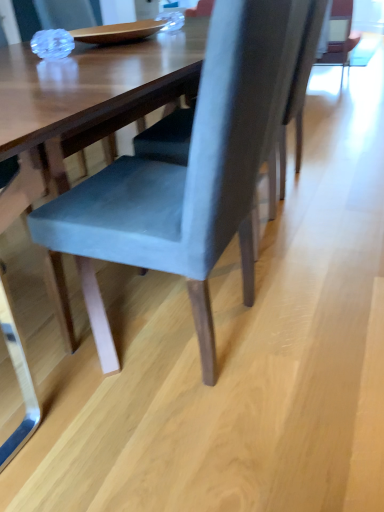
Question: Which direction should I rotate to look at velvet blue chair at center, the 2th chair from the back?

Choices:
 (A) left
 (B) right

Answer: (A)

Question: In which direction should I rotate to look at suede-like gray chair at center, the 2th chair viewed from the front?

Choices:
 (A) right
 (B) left

Answer: (A)

Question: From a real-world perspective, is velvet blue chair at center, placed as the 1th chair when sorted from front to back, located beneath suede-like gray chair at center, the 2th chair viewed from the front?

Choices:
 (A) no
 (B) yes

Answer: (A)

Question: Considering the relative sizes of velvet blue chair at center, the 2th chair from the back, and suede-like gray chair at center, the 2th chair viewed from the front, in the image provided, is velvet blue chair at center, the 2th chair from the back, thinner than suede-like gray chair at center, the 2th chair viewed from the front,?

Choices:
 (A) yes
 (B) no

Answer: (A)

Question: Does velvet blue chair at center, placed as the 1th chair when sorted from front to back, have a smaller size compared to suede-like gray chair at center, marked as the first chair in a back-to-front arrangement?

Choices:
 (A) no
 (B) yes

Answer: (A)

Question: Could you tell me if velvet blue chair at center, the 2th chair from the back, is facing suede-like gray chair at center, marked as the first chair in a back-to-front arrangement?

Choices:
 (A) no
 (B) yes

Answer: (A)

Question: Can you confirm if velvet blue chair at center, placed as the 1th chair when sorted from front to back, is bigger than suede-like gray chair at center, marked as the first chair in a back-to-front arrangement?

Choices:
 (A) yes
 (B) no

Answer: (A)

Question: Can you confirm if velvet blue chair at center, the 2th chair from the back, is wider than suede-like gray chair at center, marked as the first chair in a back-to-front arrangement?

Choices:
 (A) no
 (B) yes

Answer: (A)

Question: Considering the relative sizes of suede-like gray chair at center, the 2th chair viewed from the front, and velvet blue chair at center, the 2th chair from the back, in the image provided, is suede-like gray chair at center, the 2th chair viewed from the front, thinner than velvet blue chair at center, the 2th chair from the back,?

Choices:
 (A) yes
 (B) no

Answer: (B)

Question: From the image's perspective, is suede-like gray chair at center, marked as the first chair in a back-to-front arrangement, below velvet blue chair at center, the 2th chair from the back?

Choices:
 (A) yes
 (B) no

Answer: (B)

Question: Is suede-like gray chair at center, the 2th chair viewed from the front, with velvet blue chair at center, the 2th chair from the back?

Choices:
 (A) no
 (B) yes

Answer: (A)

Question: Does suede-like gray chair at center, the 2th chair viewed from the front, come behind velvet blue chair at center, placed as the 1th chair when sorted from front to back?

Choices:
 (A) no
 (B) yes

Answer: (B)

Question: Is suede-like gray chair at center, the 2th chair viewed from the front, smaller than velvet blue chair at center, the 2th chair from the back?

Choices:
 (A) yes
 (B) no

Answer: (A)

Question: Is suede-like gray chair at center, marked as the first chair in a back-to-front arrangement, positioned beyond the bounds of velvet blue chair at center, placed as the 1th chair when sorted from front to back?

Choices:
 (A) yes
 (B) no

Answer: (A)

Question: Based on their positions, is velvet blue chair at center, placed as the 1th chair when sorted from front to back, located to the left or right of suede-like gray chair at center, marked as the first chair in a back-to-front arrangement?

Choices:
 (A) right
 (B) left

Answer: (B)